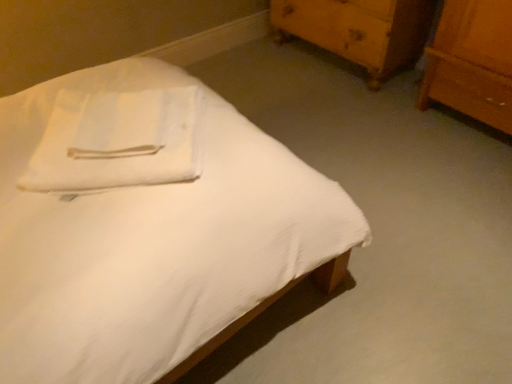
Identify the location of free space to the right of white matte bed at center. The image size is (512, 384). (410, 236).